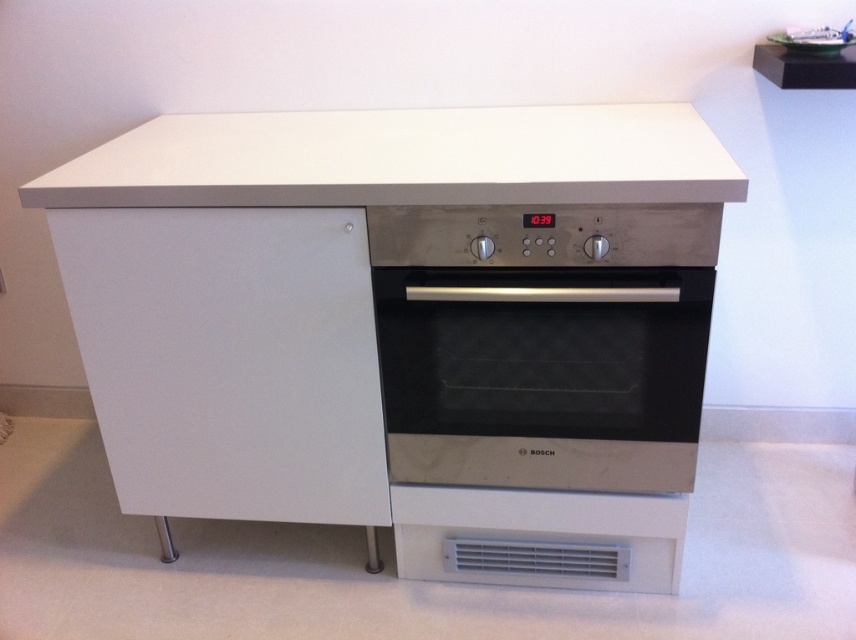
You are standing in a modern kitchen and want to adjust the oven settings. The stainless steel oven at center has a control panel at its top front. Can you reach the control panel if you are 5 feet tall without standing on anything?

The stainless steel oven at center is 4.25 feet away from viewer. Since the control panel is at the top front of the oven, and the oven itself is 4.25 feet away, a person who is 5 feet tall should be able to reach the control panel without needing to stand on anything.

You are a kitchen designer planning to install a new appliance. You have a white matte drawer at left and a stainless steel oven at center in the design. Which object is taller in the current setup?

The white matte drawer at left is much taller than the stainless steel oven at center in the current setup.

You are organizing your kitchen and need to place a spice jar on the white matte countertop at upper center. However, there is a white matte drawer at left nearby. Which direction should you move the drawer to make space for the spice jar?

The white matte drawer at left is already to the left of the white matte countertop at upper center. To make space for the spice jar, you should move the drawer further to the left away from the countertop.